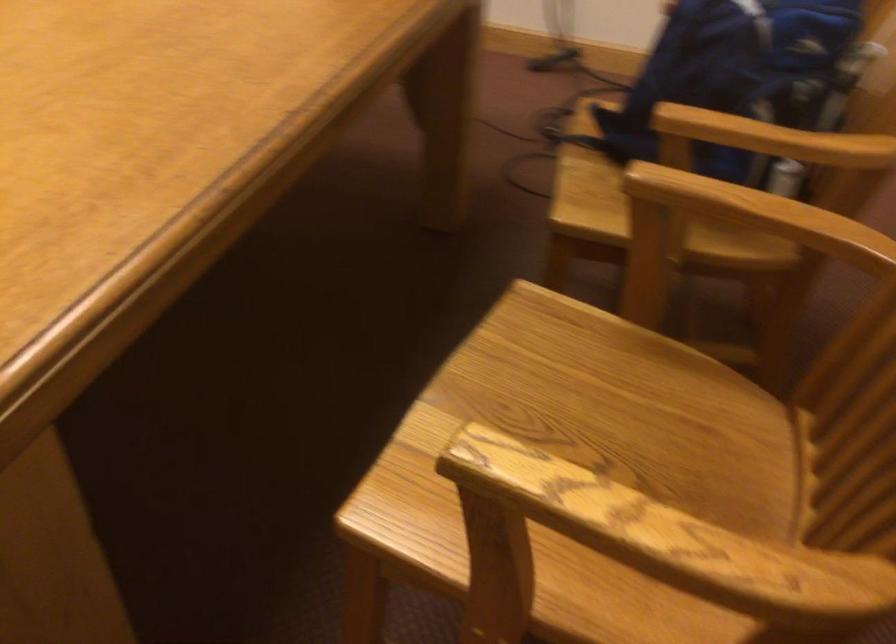
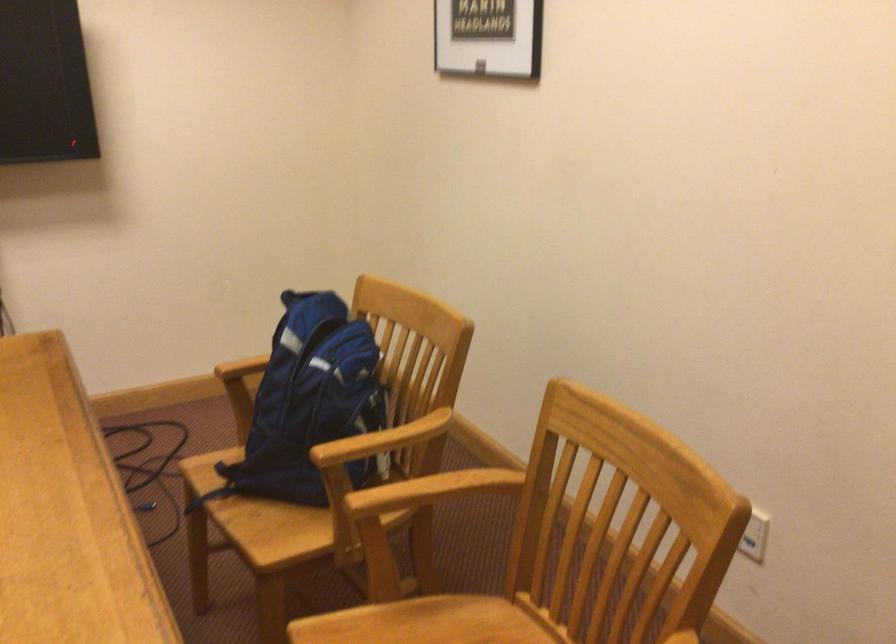
Find the pixel in the second image that matches point (762, 135) in the first image.

(383, 440)